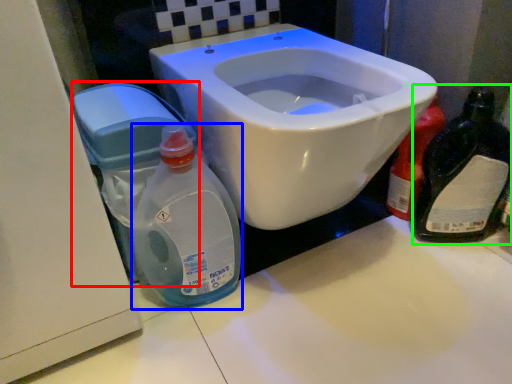
Question: Estimate the real-world distances between objects in this image. Which object is farther from water tank (highlighted by a red box), baby bottle (highlighted by a blue box) or bottle (highlighted by a green box)?

Choices:
 (A) baby bottle
 (B) bottle

Answer: (B)